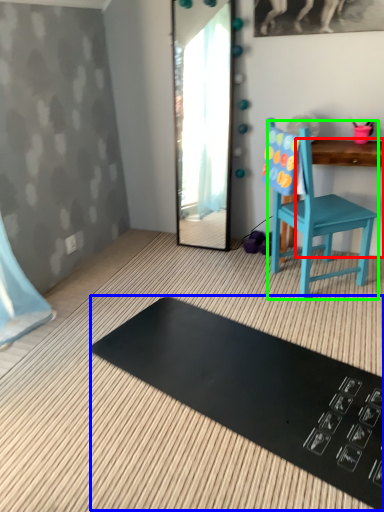
Question: Which object is the farthest from changing table (highlighted by a red box)? Choose among these: mat (highlighted by a blue box) or chair (highlighted by a green box).

Choices:
 (A) mat
 (B) chair

Answer: (A)